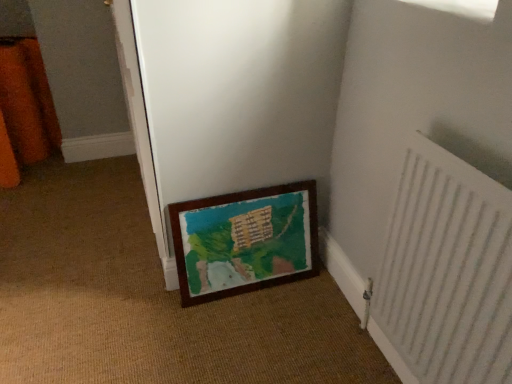
In order to click on white textured radiator at lower right in this screenshot , I will do `click(446, 272)`.

Measure the distance between point [268,248] and camera.

The depth of point [268,248] is 5.04 feet.

In order to face wooden frame at lower center, should I rotate leftwards or rightwards?

Rotate left and turn 0.483 degrees.

What do you see at coordinates (236, 97) in the screenshot? I see `wooden frame at lower center` at bounding box center [236, 97].

The width and height of the screenshot is (512, 384). What are the coordinates of `white textured radiator at lower right` in the screenshot? It's located at (446, 272).

Which object is thinner, wooden frame at lower center or wooden frame at lower center?

Thinner between the two is wooden frame at lower center.

Can you confirm if wooden frame at lower center is smaller than wooden frame at lower center?

→ No.

Is wooden frame at lower center far from wooden frame at lower center?

They are positioned close to each other.

Does point (425, 261) come behind point (168, 223)?

That is False.

Is white textured radiator at lower right looking in the opposite direction of wooden frame at lower center?

No, wooden frame at lower center is not at the back of white textured radiator at lower right.

Measure the distance from white textured radiator at lower right to wooden frame at lower center.

white textured radiator at lower right is 23.53 inches away from wooden frame at lower center.

Is the position of white textured radiator at lower right more distant than that of wooden frame at lower center?

No, the depth of white textured radiator at lower right is less than that of wooden frame at lower center.

Can you tell me how much wooden frame at lower center and white textured radiator at lower right differ in facing direction?

The angular difference between wooden frame at lower center and white textured radiator at lower right is 0.155 degrees.

Is wooden frame at lower center wider or thinner than white textured radiator at lower right?

Considering their sizes, wooden frame at lower center looks broader than white textured radiator at lower right.

Could you tell me if wooden frame at lower center is turned towards white textured radiator at lower right?

No, wooden frame at lower center is not turned towards white textured radiator at lower right.

Which is more to the left, wooden frame at lower center or white textured radiator at lower right?

From the viewer's perspective, wooden frame at lower center appears more on the left side.

Is white textured radiator at lower right at the back of wooden frame at lower center?

No, wooden frame at lower center's orientation is not away from white textured radiator at lower right.

In terms of height, does wooden frame at lower center look taller or shorter compared to white textured radiator at lower right?

Clearly, wooden frame at lower center is shorter compared to white textured radiator at lower right.

Considering the sizes of objects wooden frame at lower center and white textured radiator at lower right in the image provided, who is bigger, wooden frame at lower center or white textured radiator at lower right?

white textured radiator at lower right.

In the scene shown: From the image's perspective, which is above, wooden frame at lower center or white textured radiator at lower right?

wooden frame at lower center appears higher in the image.

Is wooden frame at lower center to the left or to the right of wooden frame at lower center in the image?

wooden frame at lower center is to the right of wooden frame at lower center.

Are wooden frame at lower center and wooden frame at lower center beside each other?

No, wooden frame at lower center is not touching wooden frame at lower center.

Locate an element on the screen. This screenshot has height=384, width=512. picture frame located behind the wooden frame at lower center is located at coordinates (246, 239).

Looking at this image, can wooden frame at lower center be found inside wooden frame at lower center?

No, wooden frame at lower center is located outside of wooden frame at lower center.

Can you confirm if white textured radiator at lower right is taller than wooden frame at lower center?

Yes.

Based on their positions, is white textured radiator at lower right located to the left or right of wooden frame at lower center?

white textured radiator at lower right is to the right of wooden frame at lower center.

Can you confirm if white textured radiator at lower right is smaller than wooden frame at lower center?

No, white textured radiator at lower right is not smaller than wooden frame at lower center.

From the image's perspective, is white textured radiator at lower right beneath wooden frame at lower center?

Correct, white textured radiator at lower right appears lower than wooden frame at lower center in the image.

Identify the location of screen door on the left of wooden frame at lower center. (236, 97).

Identify the location of radiator that is on the right side of wooden frame at lower center. This screenshot has height=384, width=512. (446, 272).

Which object lies nearer to the anchor point wooden frame at lower center, wooden frame at lower center or white textured radiator at lower right?

wooden frame at lower center.

When comparing their distances from wooden frame at lower center, does white textured radiator at lower right or wooden frame at lower center seem further?

white textured radiator at lower right is further to wooden frame at lower center.

From the image, which object appears to be farther from wooden frame at lower center, wooden frame at lower center or white textured radiator at lower right?

Among the two, white textured radiator at lower right is located further to wooden frame at lower center.

Based on their spatial positions, is wooden frame at lower center or wooden frame at lower center closer to white textured radiator at lower right?

Based on the image, wooden frame at lower center appears to be nearer to white textured radiator at lower right.

Looking at the image, which one is located further to white textured radiator at lower right, wooden frame at lower center or wooden frame at lower center?

wooden frame at lower center.

Based on their spatial positions, is white textured radiator at lower right or wooden frame at lower center further from wooden frame at lower center?

white textured radiator at lower right is further to wooden frame at lower center.

This screenshot has height=384, width=512. What are the coordinates of `picture frame between wooden frame at lower center and white textured radiator at lower right in the up-down direction` in the screenshot? It's located at (246, 239).